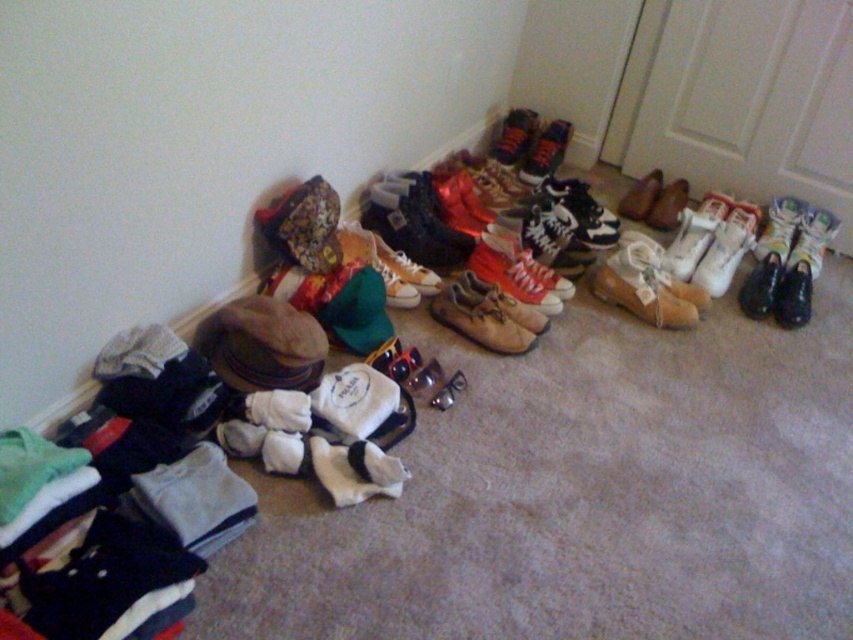
What is the 2D coordinate of the white leather sneaker at upper right in the image?

The white leather sneaker at upper right is located at the 2D coordinate point of (811, 241).